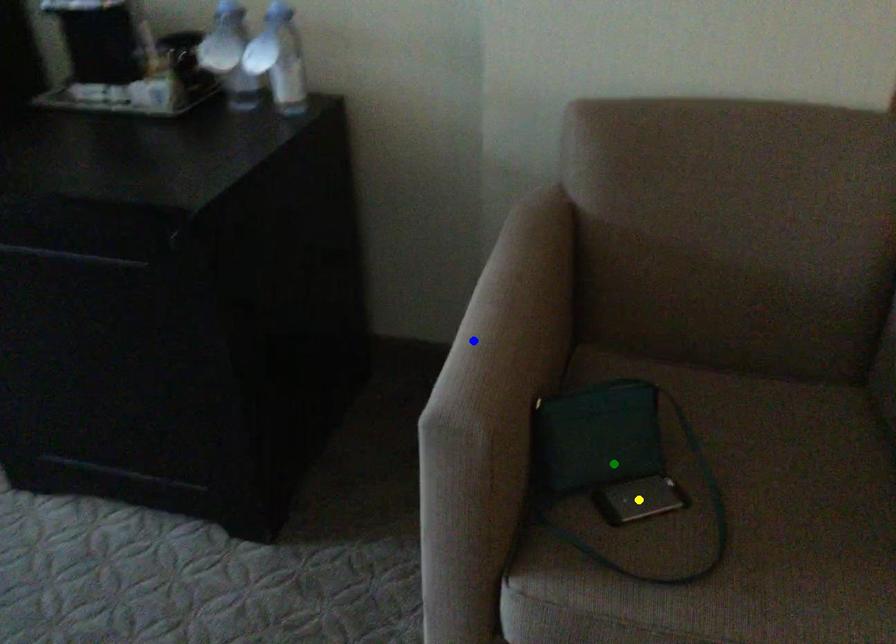
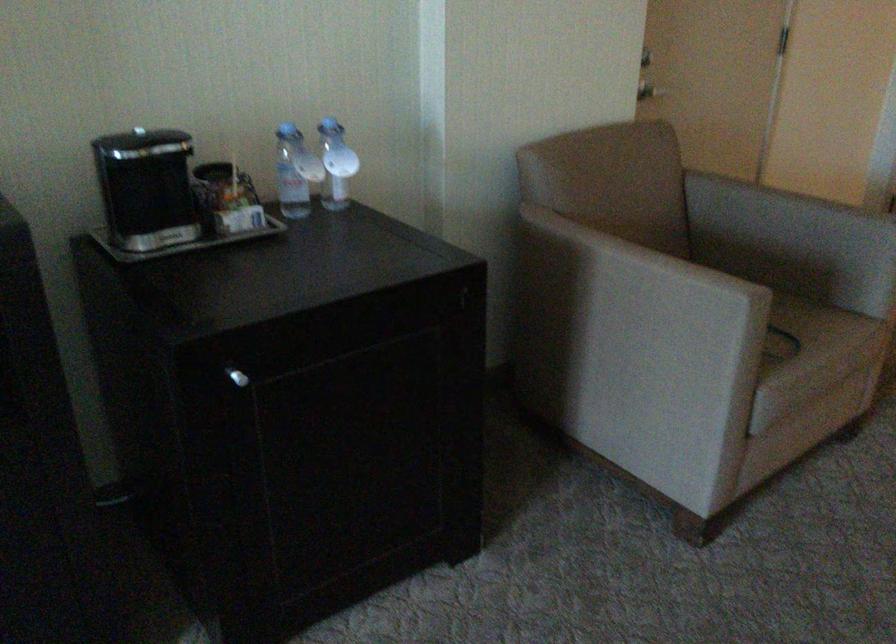
I am providing you with two images of the same scene from different viewpoints. Three points are marked in image1. Which point corresponds to a part or object that is occluded in image2?In image1, three points are marked. Which of them correspond to a part or object that is occluded in image2?Among the three points shown in image1, which one corresponds to a part or object that is no longer visible due to occlusion in image2?

green point, yellow point cannot be seen in image2.